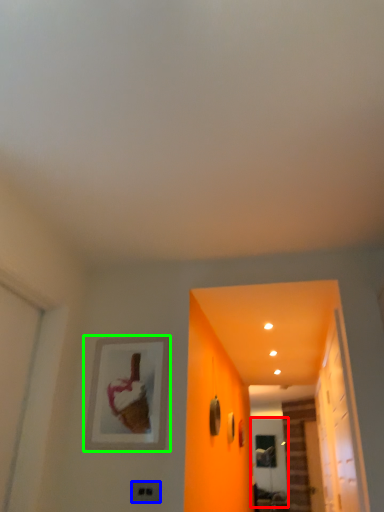
Question: Which object is the closest to the screen door (highlighted by a red box)? Choose among these: electric outlet (highlighted by a blue box) or picture frame (highlighted by a green box).

Choices:
 (A) electric outlet
 (B) picture frame

Answer: (B)